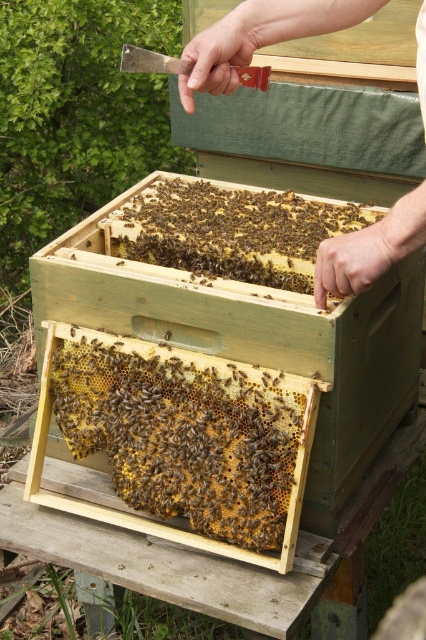
Question: Can you confirm if brown wax comb at center is positioned below smooth wooden hive at center?

Choices:
 (A) no
 (B) yes

Answer: (B)

Question: Which point is farther to the camera?

Choices:
 (A) (160, 211)
 (B) (354, 284)

Answer: (A)

Question: Which point is closer to the camera?

Choices:
 (A) brown wax comb at center
 (B) brown textured honeycomb at center
 (C) wooden beehive at center
 (D) smooth wooden hive at center

Answer: (D)

Question: Which point is farther to the camera?

Choices:
 (A) (379, 305)
 (B) (250, 28)

Answer: (A)

Question: Can you confirm if brown textured honeycomb at center is positioned to the left of smooth wooden hive at center?

Choices:
 (A) yes
 (B) no

Answer: (A)

Question: Is brown wax comb at center positioned behind smooth wooden hive at center?

Choices:
 (A) no
 (B) yes

Answer: (B)